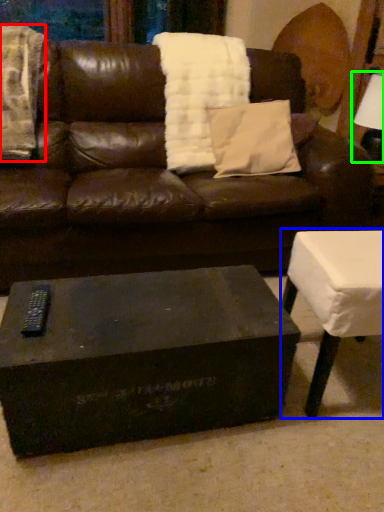
Question: Which is nearer to the blanket (highlighted by a red box)? table (highlighted by a blue box) or table lamp (highlighted by a green box).

Choices:
 (A) table
 (B) table lamp

Answer: (A)